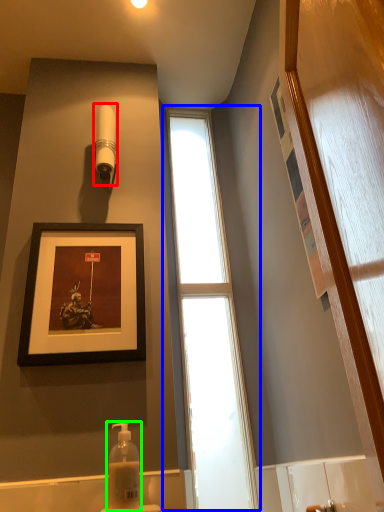
Question: Considering the real-world distances, which object is closest to shower (highlighted by a red box)? window (highlighted by a blue box) or soap dispenser (highlighted by a green box).

Choices:
 (A) window
 (B) soap dispenser

Answer: (A)